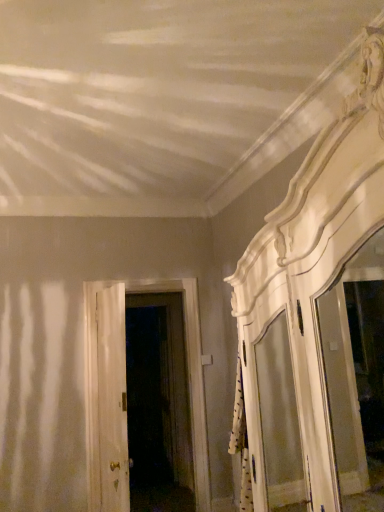
Question: Is white wooden door at center, placed as the first door when sorted from front to back, bigger or smaller than white wooden door at center, the first door when ordered from back to front?

Choices:
 (A) big
 (B) small

Answer: (B)

Question: Visually, is white wooden door at center, the second door positioned from the back, positioned to the left or to the right of white wooden door at center, the first door when ordered from back to front?

Choices:
 (A) left
 (B) right

Answer: (A)

Question: Is point (94, 296) positioned closer to the camera than point (196, 343)?

Choices:
 (A) closer
 (B) farther

Answer: (A)

Question: In the image, is white wooden door at center, placed as the 2th door when sorted from front to back, on the left side or the right side of white wooden door at center, the second door positioned from the back?

Choices:
 (A) right
 (B) left

Answer: (A)

Question: Considering the positions of white wooden door at center, placed as the 2th door when sorted from front to back, and white wooden door at center, placed as the first door when sorted from front to back, in the image, is white wooden door at center, placed as the 2th door when sorted from front to back, taller or shorter than white wooden door at center, placed as the first door when sorted from front to back,?

Choices:
 (A) short
 (B) tall

Answer: (B)

Question: Considering the positions of white wooden door at center, placed as the 2th door when sorted from front to back, and white wooden door at center, placed as the first door when sorted from front to back, in the image, is white wooden door at center, placed as the 2th door when sorted from front to back, bigger or smaller than white wooden door at center, placed as the first door when sorted from front to back,?

Choices:
 (A) small
 (B) big

Answer: (B)

Question: From a real-world perspective, is white wooden door at center, the first door when ordered from back to front, physically located above or below white wooden door at center, the second door positioned from the back?

Choices:
 (A) below
 (B) above

Answer: (A)